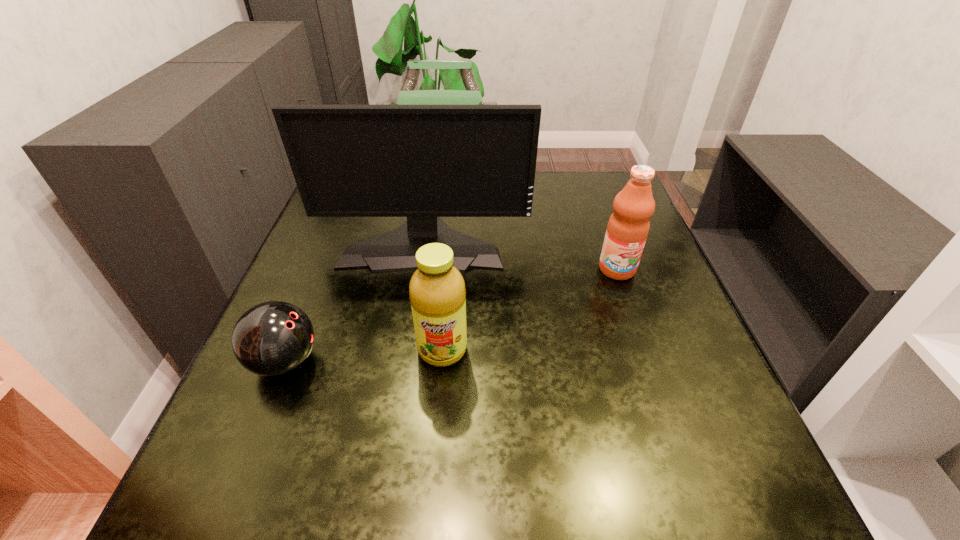
Identify the location of free point between the monitor and the bowling ball. Image resolution: width=960 pixels, height=540 pixels. (354, 302).

You are a GUI agent. You are given a task and a screenshot of the screen. Output one action in this format:
    pyautogui.click(x=<x>, y=<y>)
    Task: Click on the vacant region between the right fruit juice and the monitor
    
    Given the screenshot: What is the action you would take?
    pyautogui.click(x=520, y=256)

Identify the location of vacant space that's between the shortest object and the monitor. The width and height of the screenshot is (960, 540). (354, 302).

At what (x,y) coordinates should I click in order to perform the action: click on vacant point located between the tallest object and the right fruit juice. Please return your answer as a coordinate pair (x, y). The height and width of the screenshot is (540, 960). Looking at the image, I should click on (520, 256).

The height and width of the screenshot is (540, 960). Identify the location of free area in between the rightmost object and the nearer fruit juice. (530, 309).

You are a GUI agent. You are given a task and a screenshot of the screen. Output one action in this format:
    pyautogui.click(x=<x>, y=<y>)
    Task: Click on the free space between the monitor and the shortest object
    This screenshot has width=960, height=540.
    Given the screenshot: What is the action you would take?
    pyautogui.click(x=354, y=302)

Where is `the second closest object to the shortest object`? Image resolution: width=960 pixels, height=540 pixels. the second closest object to the shortest object is located at coordinates (423, 162).

This screenshot has width=960, height=540. I want to click on object that is the third closest to the tallest object, so click(x=273, y=338).

This screenshot has height=540, width=960. I want to click on free spot that satisfies the following two spatial constraints: 1. on the front label of the farther fruit juice; 2. on the surface of the shortest object near the finger holes, so click(x=650, y=362).

Where is `vacant position in the image that satisfies the following two spatial constraints: 1. on the front label of the right fruit juice; 2. on the surface of the bowling ball near the finger holes`? This screenshot has height=540, width=960. vacant position in the image that satisfies the following two spatial constraints: 1. on the front label of the right fruit juice; 2. on the surface of the bowling ball near the finger holes is located at coordinates (650, 362).